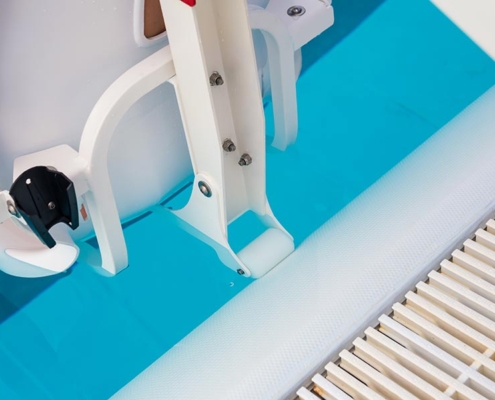
Find the location of a particular element. The image size is (495, 400). drain is located at coordinates (455, 363).